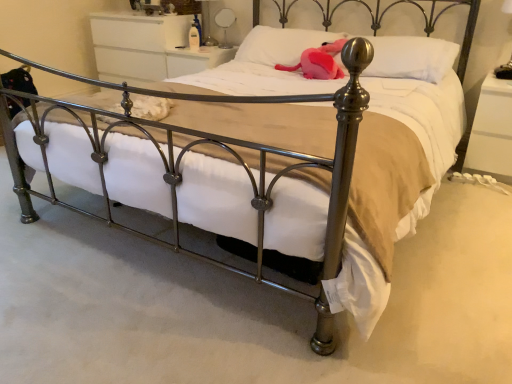
Find the location of `blank area beneath metallic silver table lamp at upper center, which is counted as the first table lamp, starting from the left (from a real-world perspective)`. blank area beneath metallic silver table lamp at upper center, which is counted as the first table lamp, starting from the left (from a real-world perspective) is located at coordinates (211, 47).